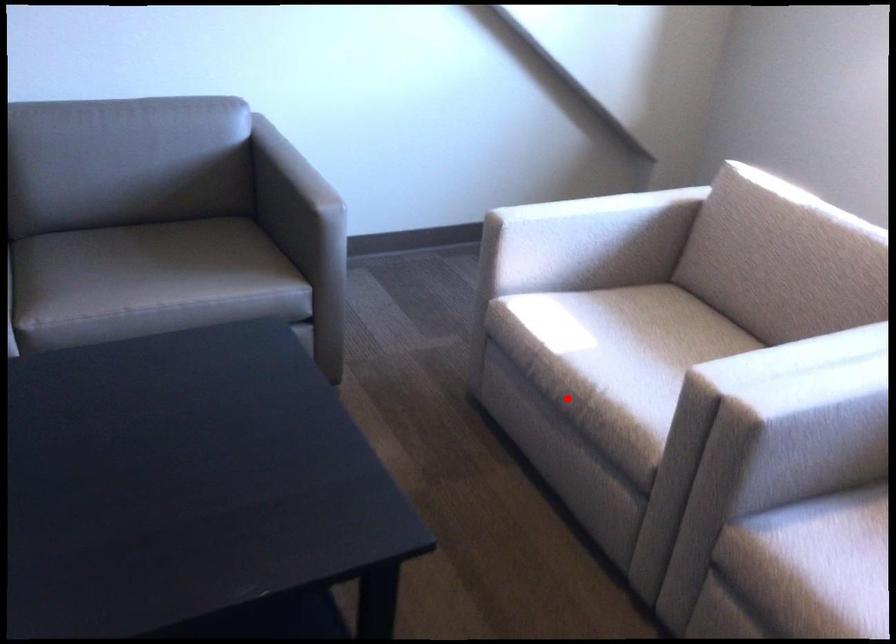
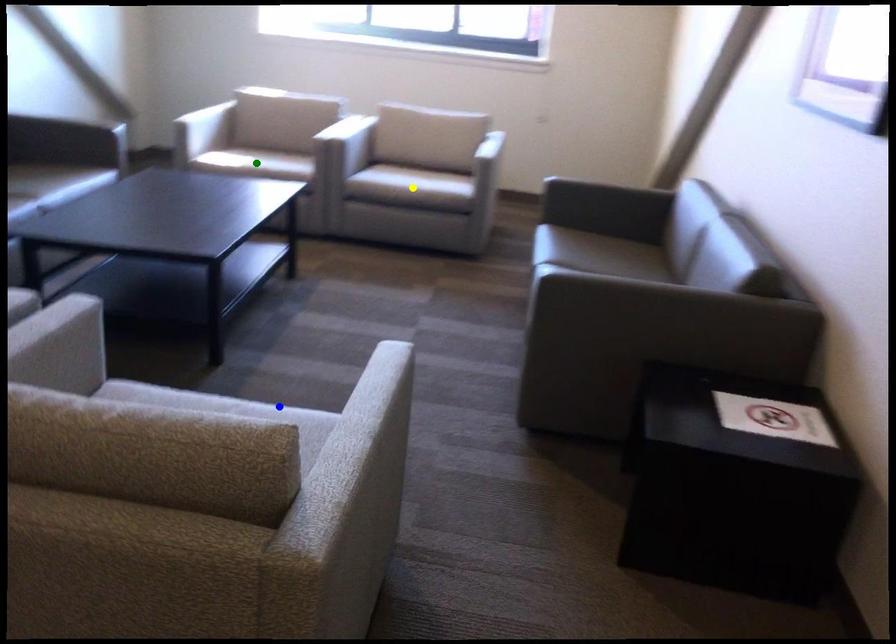
Question: I am providing you with two images of the same scene from different viewpoints. A red point is marked on the first image. You are given multiple points on the second image. Which spot in image 2 lines up with the point in image 1?

Choices:
 (A) yellow point
 (B) blue point
 (C) green point

Answer: (C)